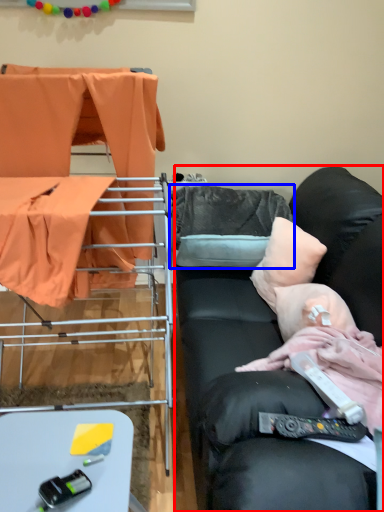
Question: Which object is further to the camera taking this photo, studio couch (highlighted by a red box) or pillow (highlighted by a blue box)?

Choices:
 (A) studio couch
 (B) pillow

Answer: (B)